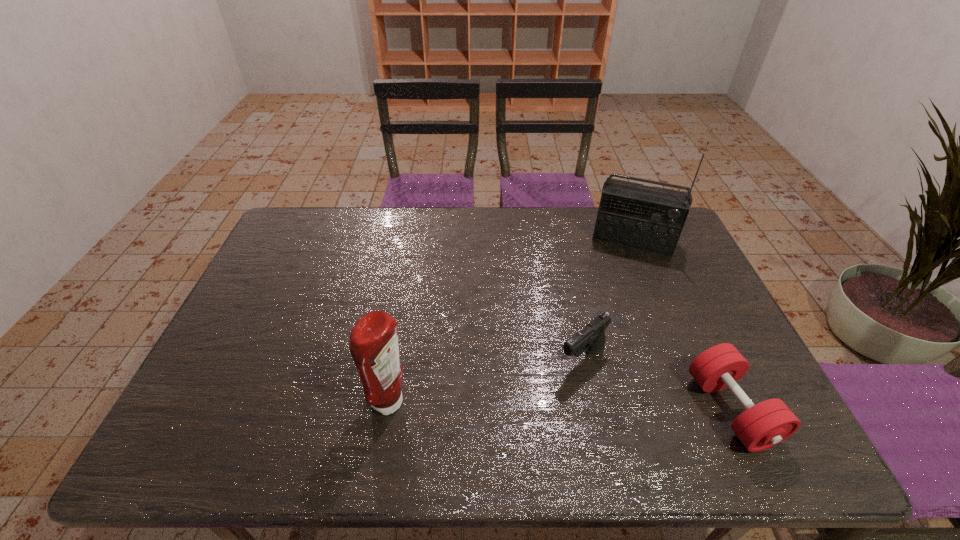
Where is `vacant point located at the barrel of the third object from right to left`? The height and width of the screenshot is (540, 960). vacant point located at the barrel of the third object from right to left is located at coordinates (521, 410).

In order to click on free spot located 0.390m on the front panel of the radio receiver in this screenshot , I will do `click(604, 344)`.

I want to click on free space located 0.160m on the front panel of the radio receiver, so click(616, 288).

This screenshot has width=960, height=540. Find the location of `free space located on the front panel of the radio receiver`. free space located on the front panel of the radio receiver is located at coordinates (616, 290).

Identify the location of object at the far edge. Image resolution: width=960 pixels, height=540 pixels. (651, 219).

Locate an element on the screen. This screenshot has height=540, width=960. condiment positioned at the near edge is located at coordinates (374, 347).

Where is `dumbbell that is positioned at the near edge`? This screenshot has width=960, height=540. dumbbell that is positioned at the near edge is located at coordinates (761, 426).

Find the location of a particular element. The height and width of the screenshot is (540, 960). dumbbell that is at the right edge is located at coordinates (761, 426).

This screenshot has width=960, height=540. I want to click on radio receiver located at the right edge, so click(x=651, y=219).

Locate an element on the screen. The image size is (960, 540). object present at the far right corner is located at coordinates (651, 219).